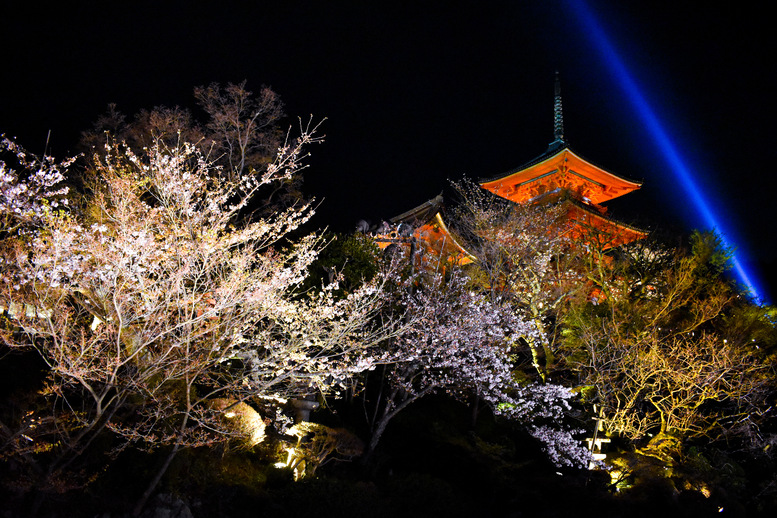
The image size is (777, 518). In order to click on windows in this screenshot , I will do `click(548, 171)`, `click(587, 179)`.